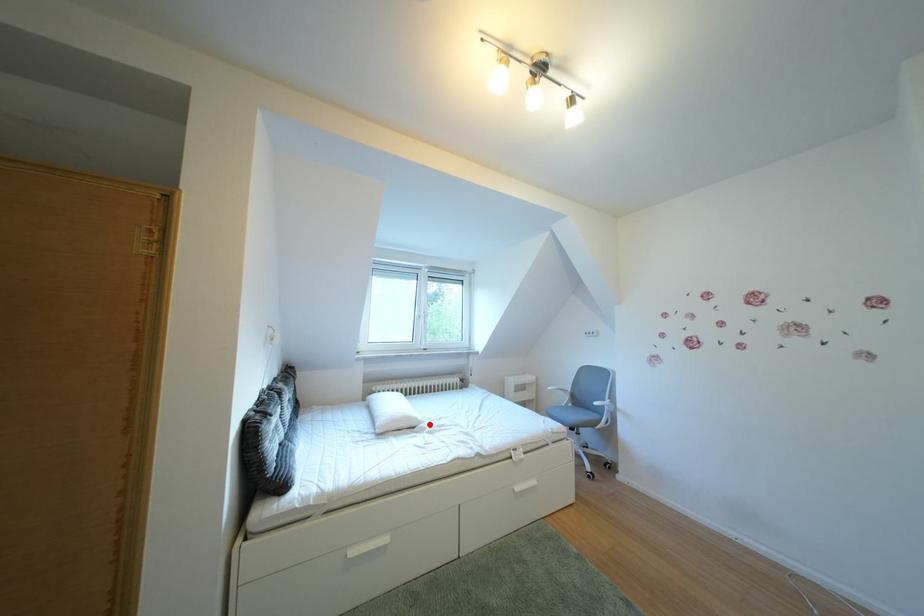
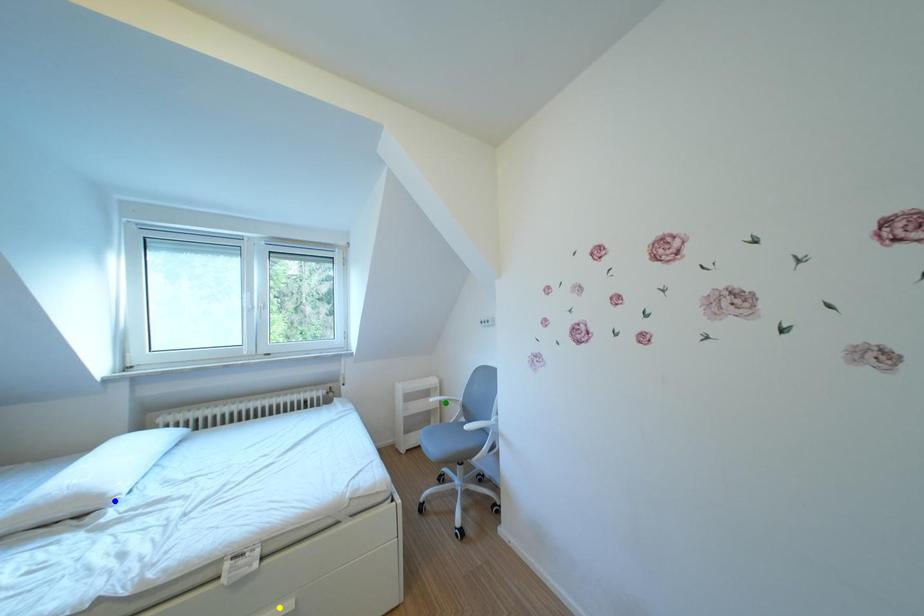
Question: I am providing you with two images of the same scene from different viewpoints. A red point is marked on the first image. You are given multiple points on the second image. Which mark in image 2 goes with the point in image 1?

Choices:
 (A) green point
 (B) blue point
 (C) yellow point

Answer: (B)